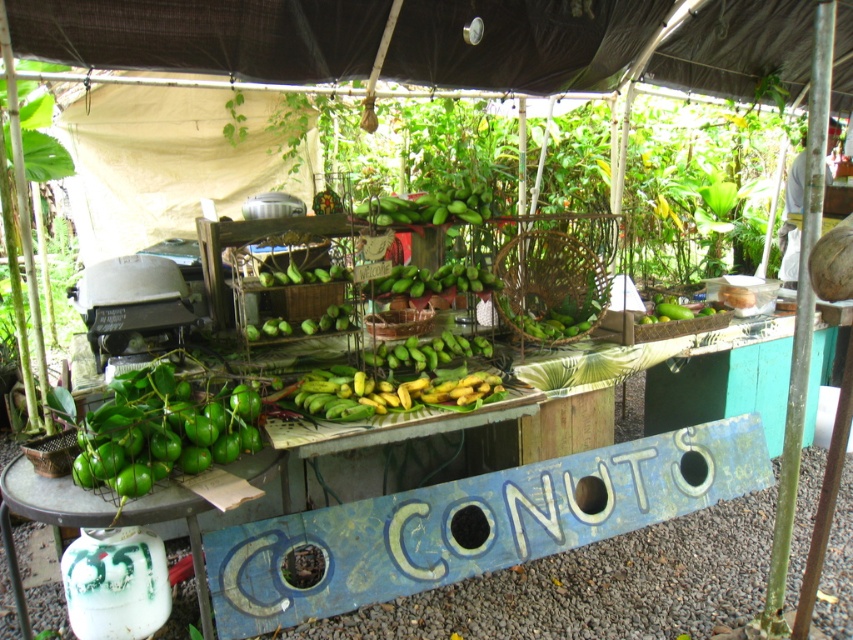
Question: Which object is farther from the camera taking this photo?

Choices:
 (A) green matte limes at lower left
 (B) green matte bananas at center

Answer: (B)

Question: Among these objects, which one is farthest from the camera?

Choices:
 (A) green matte fruit basket at lower left
 (B) green matte mangoes at center

Answer: (B)

Question: Which object is the farthest from the green matte mangoes at center?

Choices:
 (A) green matte limes at lower left
 (B) green matte bananas at center
 (C) green matte fruit basket at lower left

Answer: (A)

Question: Is green matte fruit basket at lower left wider than green matte bananas at center?

Choices:
 (A) yes
 (B) no

Answer: (A)

Question: Where is green matte fruit basket at lower left located in relation to green matte bananas at center in the image?

Choices:
 (A) above
 (B) below

Answer: (B)

Question: Does green matte limes at lower left have a larger size compared to green matte bananas at center?

Choices:
 (A) yes
 (B) no

Answer: (A)